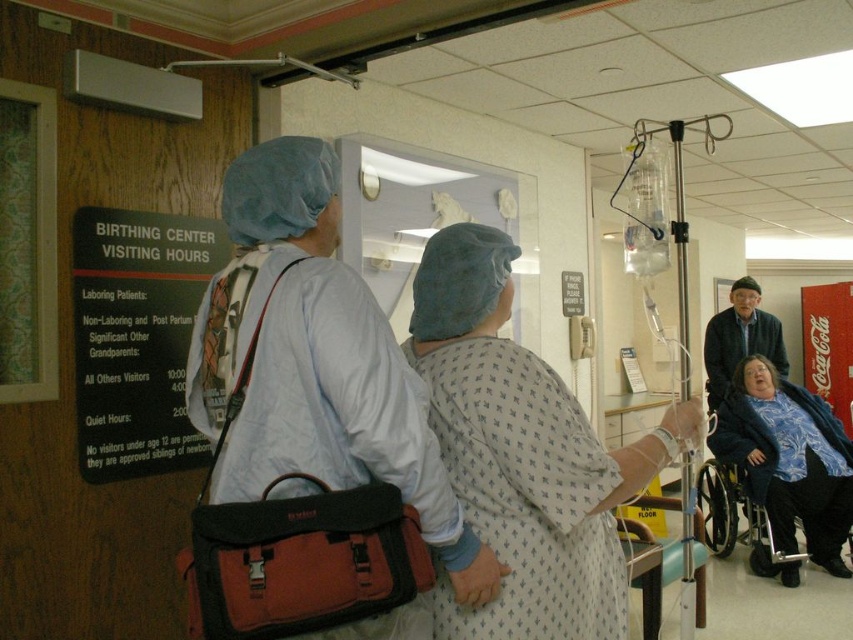
Can you confirm if matte blue surgical cap at center is positioned to the left of black cardboard sign at left?

In fact, matte blue surgical cap at center is to the right of black cardboard sign at left.

Is point (291, 260) positioned after point (167, 266)?

No, (291, 260) is in front of (167, 266).

Is point (473, 540) positioned before point (122, 285)?

Yes, point (473, 540) is in front of point (122, 285).

This screenshot has height=640, width=853. I want to click on matte blue surgical cap at center, so click(x=314, y=362).

Is black cardboard sign at left to the left of dark blue knit sweater at right from the viewer's perspective?

Indeed, black cardboard sign at left is positioned on the left side of dark blue knit sweater at right.

Who is more forward, (129, 301) or (724, 381)?

Point (129, 301)

Where is `black cardboard sign at left`? The image size is (853, 640). black cardboard sign at left is located at coordinates (137, 337).

What do you see at coordinates (523, 452) in the screenshot?
I see `patterned fabric gown at center` at bounding box center [523, 452].

Who is shorter, patterned fabric gown at center or black cardboard sign at left?

With less height is black cardboard sign at left.

Who is more distant from viewer, [500,308] or [201,440]?

The point [201,440] is behind.

Where is `patterned fabric gown at center`? patterned fabric gown at center is located at coordinates (523, 452).